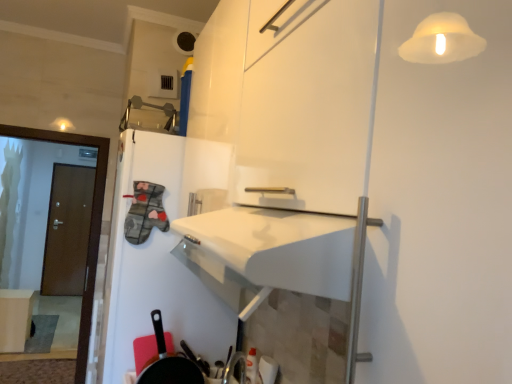
Question: Are matte white table at lower left and brown wooden door at left located far from each other?

Choices:
 (A) no
 (B) yes

Answer: (B)

Question: Is matte white table at lower left further to camera compared to brown wooden door at left?

Choices:
 (A) no
 (B) yes

Answer: (B)

Question: Is matte white table at lower left bigger than brown wooden door at left?

Choices:
 (A) no
 (B) yes

Answer: (A)

Question: Does matte white table at lower left have a greater width compared to brown wooden door at left?

Choices:
 (A) no
 (B) yes

Answer: (B)

Question: Considering the relative sizes of matte white table at lower left and brown wooden door at left in the image provided, is matte white table at lower left shorter than brown wooden door at left?

Choices:
 (A) no
 (B) yes

Answer: (B)

Question: Looking at the image, does brown wooden door at left seem bigger or smaller compared to matte white table at lower left?

Choices:
 (A) small
 (B) big

Answer: (B)

Question: From the image's perspective, relative to matte white table at lower left, is brown wooden door at left above or below?

Choices:
 (A) below
 (B) above

Answer: (B)

Question: Considering their positions, is brown wooden door at left located in front of or behind matte white table at lower left?

Choices:
 (A) behind
 (B) front

Answer: (A)

Question: Is point (93, 173) closer or farther from the camera than point (29, 329)?

Choices:
 (A) closer
 (B) farther

Answer: (B)

Question: In terms of width, does matte white table at lower left look wider or thinner when compared to black matte frying pan at lower left?

Choices:
 (A) wide
 (B) thin

Answer: (A)

Question: Considering the relative positions of matte white table at lower left and black matte frying pan at lower left in the image provided, is matte white table at lower left to the left or to the right of black matte frying pan at lower left?

Choices:
 (A) left
 (B) right

Answer: (A)

Question: From their relative heights in the image, would you say matte white table at lower left is taller or shorter than black matte frying pan at lower left?

Choices:
 (A) short
 (B) tall

Answer: (B)

Question: From the image's perspective, relative to black matte frying pan at lower left, is matte white table at lower left above or below?

Choices:
 (A) below
 (B) above

Answer: (A)

Question: Visually, is brown wooden door at left positioned to the left or to the right of black matte frying pan at lower left?

Choices:
 (A) right
 (B) left

Answer: (B)

Question: Relative to black matte frying pan at lower left, is brown wooden door at left in front or behind?

Choices:
 (A) behind
 (B) front

Answer: (A)